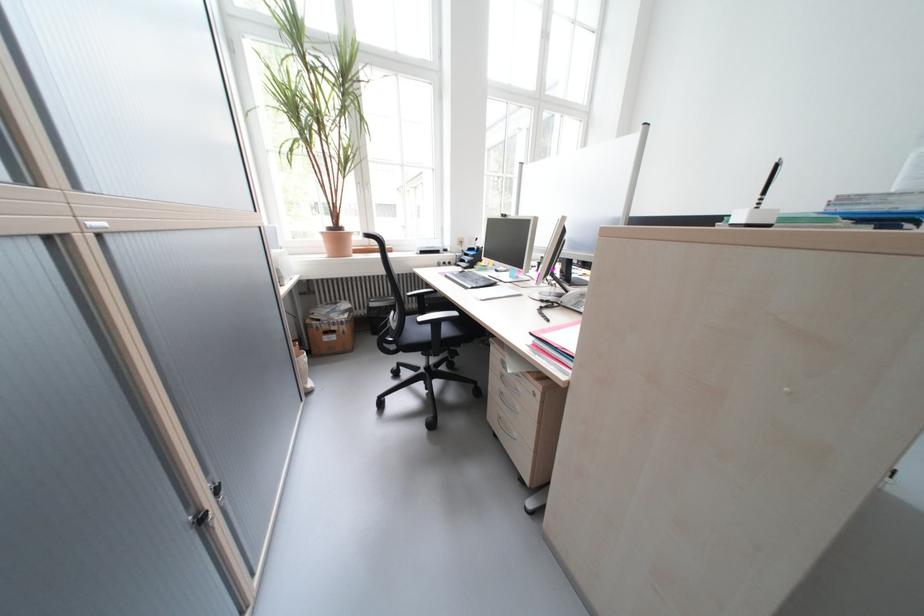
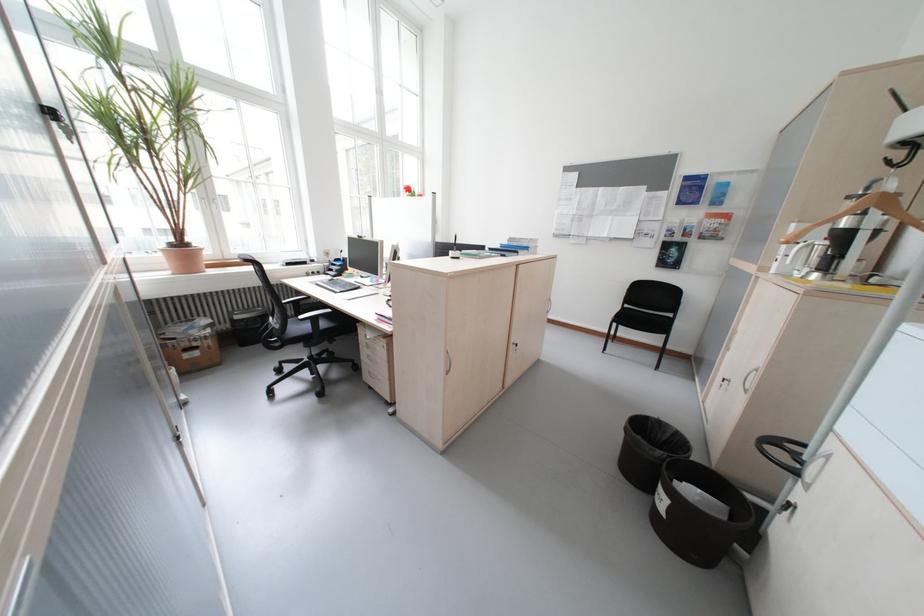
Question: Which direction would the cameraman need to move to produce the second image? Reply with the corresponding letter.

Choices:
 (A) Left
 (B) Right
 (C) Forward
 (D) Backward

Answer: (D)